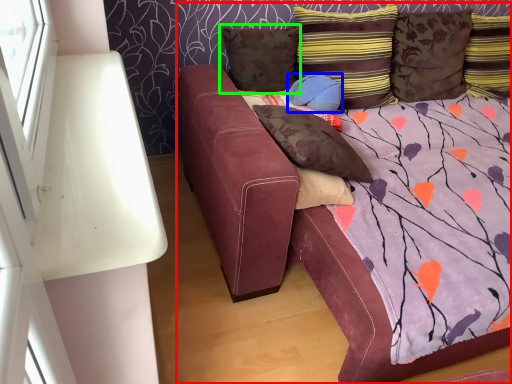
Question: Considering the real-world distances, which object is closest to studio couch (highlighted by a red box)? pillow (highlighted by a blue box) or pillow (highlighted by a green box).

Choices:
 (A) pillow
 (B) pillow

Answer: (B)